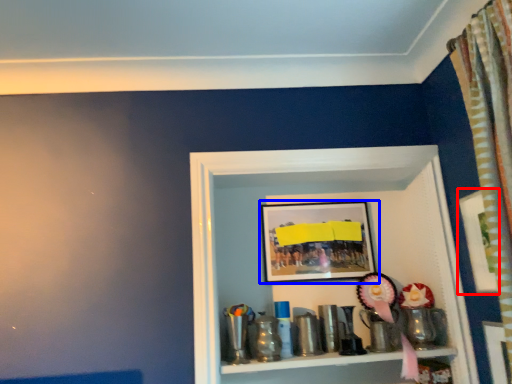
Question: Which object appears farthest to the camera in this image, picture frame (highlighted by a red box) or picture frame (highlighted by a blue box)?

Choices:
 (A) picture frame
 (B) picture frame

Answer: (B)